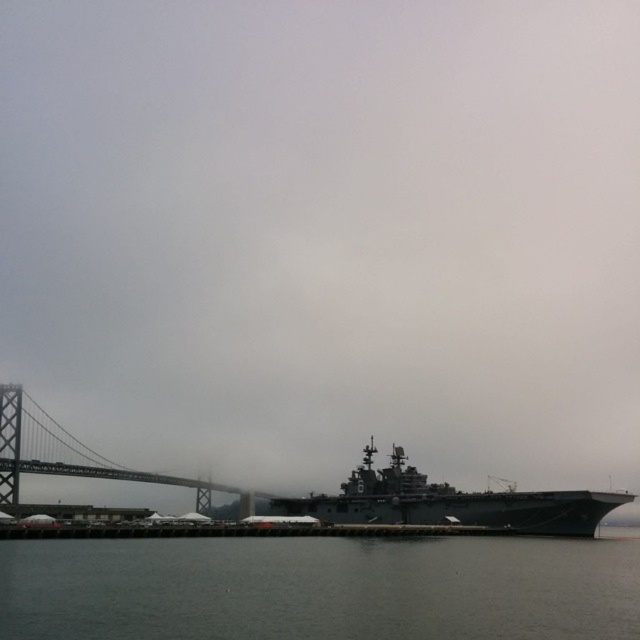
In the scene shown: Can you confirm if dark gray water at lower center is bigger than dark gray metallic aircraft carrier at center?

Incorrect, dark gray water at lower center is not larger than dark gray metallic aircraft carrier at center.

What do you see at coordinates (320, 588) in the screenshot? I see `dark gray water at lower center` at bounding box center [320, 588].

Identify the location of dark gray water at lower center. This screenshot has width=640, height=640. (320, 588).

Can you confirm if dark gray water at lower center is bigger than gray metallic bridge at left?

Incorrect, dark gray water at lower center is not larger than gray metallic bridge at left.

Is point (390, 568) behind point (177, 480)?

No, it is in front of (177, 480).

What are the coordinates of `dark gray water at lower center` in the screenshot? It's located at (320, 588).

Does dark gray metallic aircraft carrier at center appear on the left side of gray metallic bridge at left?

Answer: No, dark gray metallic aircraft carrier at center is not to the left of gray metallic bridge at left.

Does point (369, 476) lie behind point (179, 477)?

No.

This screenshot has width=640, height=640. In order to click on dark gray metallic aircraft carrier at center in this screenshot , I will do `click(451, 502)`.